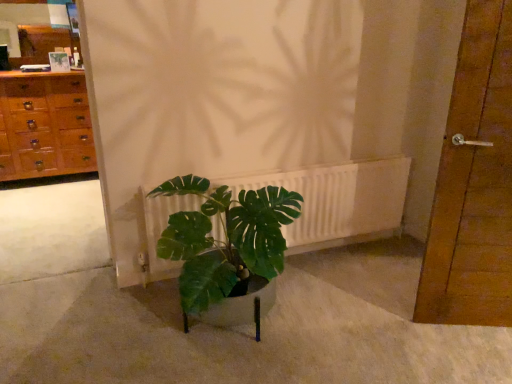
Question: Can you confirm if white matte radiator at center is thinner than matte wooden mirror at upper left?

Choices:
 (A) no
 (B) yes

Answer: (A)

Question: From the image's perspective, would you say white matte radiator at center is shown under matte wooden mirror at upper left?

Choices:
 (A) no
 (B) yes

Answer: (B)

Question: Is white matte radiator at center further to camera compared to matte wooden mirror at upper left?

Choices:
 (A) no
 (B) yes

Answer: (A)

Question: Considering the relative positions of white matte radiator at center and matte wooden mirror at upper left in the image provided, is white matte radiator at center to the left of matte wooden mirror at upper left from the viewer's perspective?

Choices:
 (A) yes
 (B) no

Answer: (B)

Question: Is white matte radiator at center touching matte wooden mirror at upper left?

Choices:
 (A) no
 (B) yes

Answer: (A)

Question: Is matte wooden mirror at upper left spatially inside brown wooden door at right, or outside of it?

Choices:
 (A) outside
 (B) inside

Answer: (A)

Question: Relative to brown wooden door at right, is matte wooden mirror at upper left in front or behind?

Choices:
 (A) behind
 (B) front

Answer: (A)

Question: From a real-world perspective, is matte wooden mirror at upper left physically located above or below brown wooden door at right?

Choices:
 (A) above
 (B) below

Answer: (A)

Question: Considering the positions of matte wooden mirror at upper left and brown wooden door at right in the image, is matte wooden mirror at upper left taller or shorter than brown wooden door at right?

Choices:
 (A) tall
 (B) short

Answer: (B)

Question: Is wooden chest of drawers at left to the left or to the right of brown wooden door at right in the image?

Choices:
 (A) right
 (B) left

Answer: (B)

Question: Would you say wooden chest of drawers at left is inside or outside brown wooden door at right?

Choices:
 (A) outside
 (B) inside

Answer: (A)

Question: Considering their positions, is wooden chest of drawers at left located in front of or behind brown wooden door at right?

Choices:
 (A) front
 (B) behind

Answer: (B)

Question: From the image's perspective, is wooden chest of drawers at left positioned above or below brown wooden door at right?

Choices:
 (A) below
 (B) above

Answer: (B)

Question: From a real-world perspective, relative to brown wooden door at right, is white matte radiator at center vertically above or below?

Choices:
 (A) below
 (B) above

Answer: (A)

Question: Is point (373, 175) positioned closer to the camera than point (465, 309)?

Choices:
 (A) farther
 (B) closer

Answer: (A)